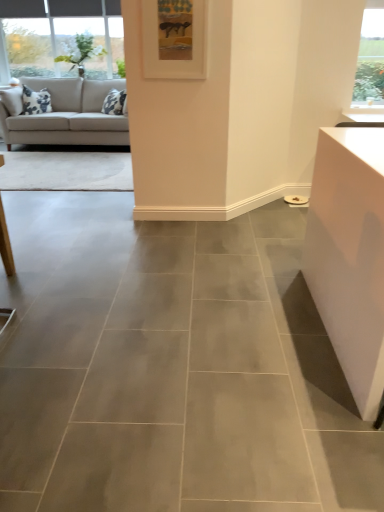
Question: Considering the positions of white matte picture frame at upper center and beige fabric couch at upper left in the image, is white matte picture frame at upper center taller or shorter than beige fabric couch at upper left?

Choices:
 (A) tall
 (B) short

Answer: (B)

Question: Is white matte picture frame at upper center wider or thinner than beige fabric couch at upper left?

Choices:
 (A) wide
 (B) thin

Answer: (B)

Question: From the image's perspective, is white matte picture frame at upper center above or below beige fabric couch at upper left?

Choices:
 (A) above
 (B) below

Answer: (B)

Question: Considering their positions, is beige fabric couch at upper left located in front of or behind white matte picture frame at upper center?

Choices:
 (A) front
 (B) behind

Answer: (B)

Question: In the image, is beige fabric couch at upper left on the left side or the right side of white matte picture frame at upper center?

Choices:
 (A) left
 (B) right

Answer: (A)

Question: From the image's perspective, relative to white matte picture frame at upper center, is beige fabric couch at upper left above or below?

Choices:
 (A) above
 (B) below

Answer: (A)

Question: From a real-world perspective, is beige fabric couch at upper left physically located above or below white matte picture frame at upper center?

Choices:
 (A) below
 (B) above

Answer: (A)